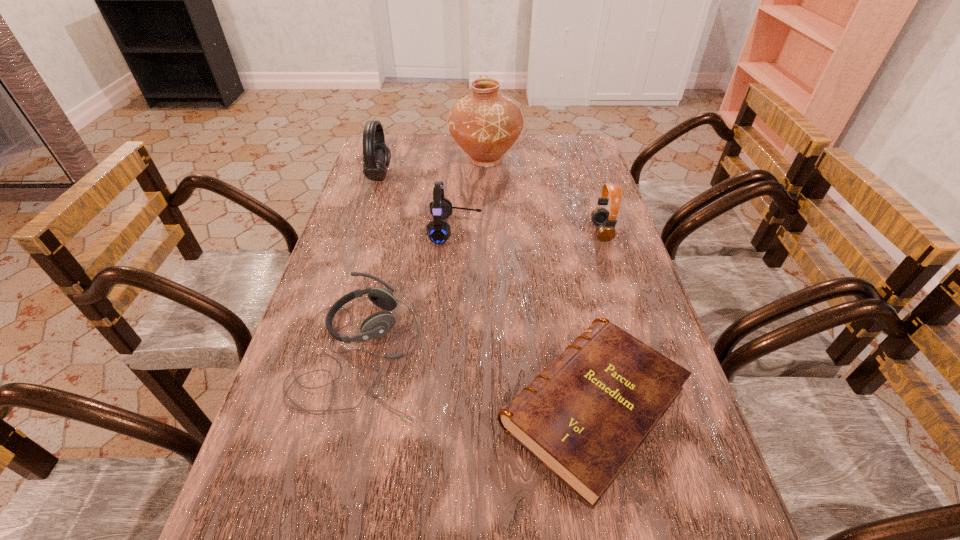
Identify which object is the fifth nearest to the tallest object. Please provide its 2D coordinates. Your answer should be formatted as a tuple, i.e. [(x, y)], where the tuple contains the x and y coordinates of a point satisfying the conditions above.

[(584, 417)]

Where is `object that stands as the fourth closest to the pottery`? object that stands as the fourth closest to the pottery is located at coordinates pos(376,325).

You are a GUI agent. You are given a task and a screenshot of the screen. Output one action in this format:
    pyautogui.click(x=<x>, y=<y>)
    Task: Click on the headset that is the second nearest to the tallest headset
    This screenshot has width=960, height=540.
    Given the screenshot: What is the action you would take?
    pyautogui.click(x=376, y=325)

Point out which headset is positioned as the third nearest to the rightmost headset. Please provide its 2D coordinates. Your answer should be formatted as a tuple, i.e. [(x, y)], where the tuple contains the x and y coordinates of a point satisfying the conditions above.

[(377, 155)]

Identify the location of vacant space that satisfies the following two spatial constraints: 1. on the earcups of the fifth shortest object; 2. on the back side of the hardback book. (307, 408).

Locate an element on the screen. This screenshot has height=540, width=960. free point that satisfies the following two spatial constraints: 1. on the back side of the hardback book; 2. on the earcups of the tallest headset is located at coordinates (545, 175).

Locate an element on the screen. This screenshot has height=540, width=960. vacant point that satisfies the following two spatial constraints: 1. on the earcups of the hardback book; 2. on the right side of the fifth shortest object is located at coordinates (307, 408).

Where is `vacant position in the image that satisfies the following two spatial constraints: 1. on the earcups of the tallest headset; 2. on the right side of the shortest object`? Image resolution: width=960 pixels, height=540 pixels. vacant position in the image that satisfies the following two spatial constraints: 1. on the earcups of the tallest headset; 2. on the right side of the shortest object is located at coordinates (307, 408).